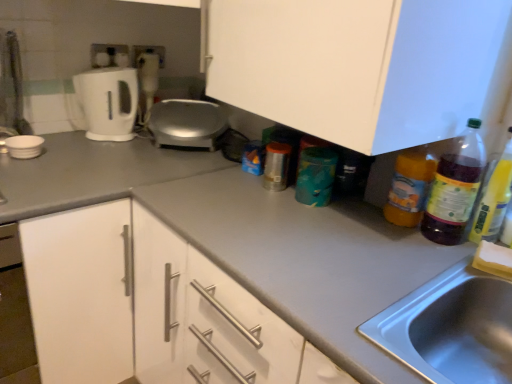
Locate an element on the screen. vacant space in white matte cabinet at center (from a real-world perspective) is located at coordinates (303, 204).